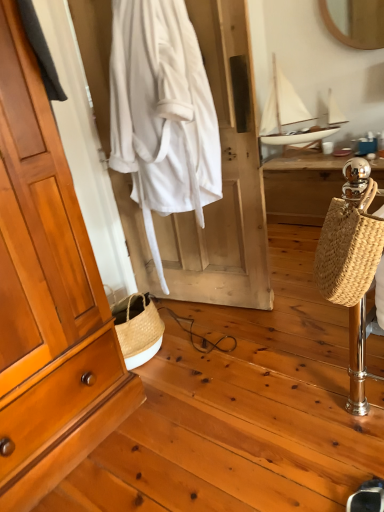
You are a GUI agent. You are given a task and a screenshot of the screen. Output one action in this format:
    pyautogui.click(x=<x>, y=<y>)
    Task: Click on the free location above woven wood desk at right (from a real-world perspective)
    
    Given the screenshot: What is the action you would take?
    pyautogui.click(x=328, y=158)